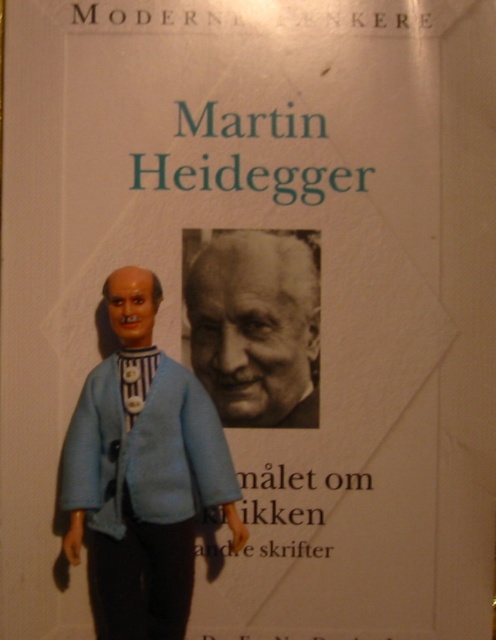
Does matte blue fabric doll at center have a lesser height compared to black and white photograph of martin heidegger at center?

No, matte blue fabric doll at center is not shorter than black and white photograph of martin heidegger at center.

Who is lower down, matte blue fabric doll at center or black and white photograph of martin heidegger at center?

matte blue fabric doll at center is below.

This screenshot has width=496, height=640. What do you see at coordinates (142, 472) in the screenshot? I see `matte blue fabric doll at center` at bounding box center [142, 472].

Locate an element on the screen. matte blue fabric doll at center is located at coordinates (142, 472).